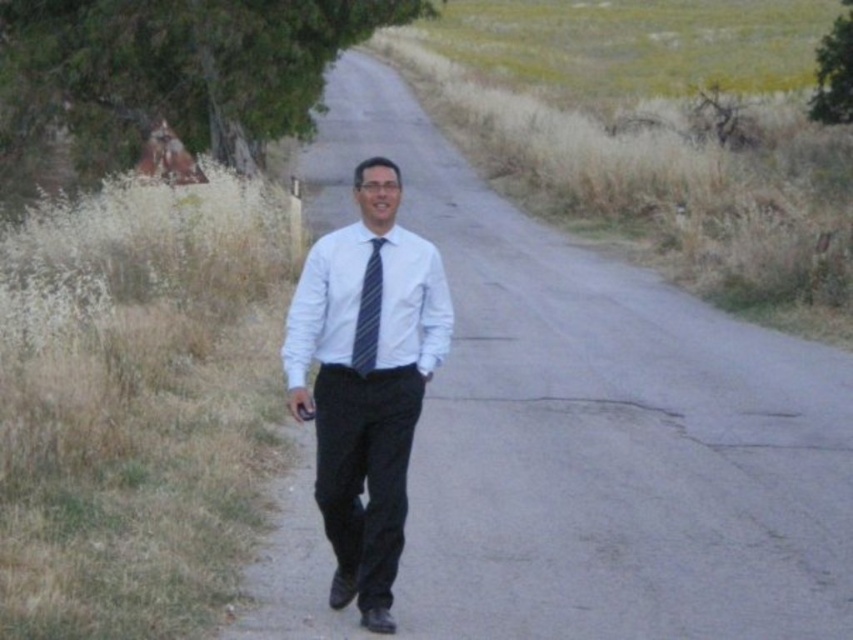
Question: Which point is farther to the camera?

Choices:
 (A) (368, 307)
 (B) (392, 602)
 (C) (833, 112)

Answer: (C)

Question: Is matte asphalt road at center to the right of matte white shirt at center from the viewer's perspective?

Choices:
 (A) no
 (B) yes

Answer: (B)

Question: Which point is closer to the camera?

Choices:
 (A) blue striped tie at center
 (B) matte asphalt road at center
 (C) green leafy tree at upper left
 (D) matte white shirt at center

Answer: (D)

Question: Among these objects, which one is nearest to the camera?

Choices:
 (A) matte white shirt at center
 (B) green leafy tree at upper left
 (C) matte asphalt road at center

Answer: (A)

Question: From the image, what is the correct spatial relationship of green leafy tree at upper left in relation to green leafy tree at upper right?

Choices:
 (A) left
 (B) right

Answer: (A)

Question: Can you confirm if matte white shirt at center is thinner than white striped shirt at center?

Choices:
 (A) no
 (B) yes

Answer: (B)